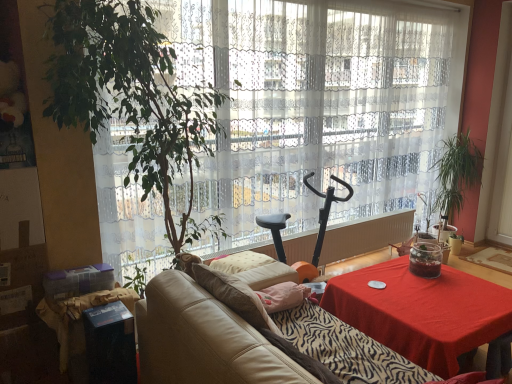
Find the location of a particular element. The image size is (512, 384). free space to the left of translucent glass jar at center is located at coordinates (394, 274).